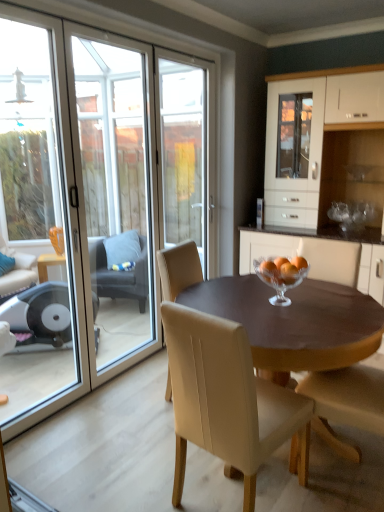
Locate an element on the screen. This screenshot has width=384, height=512. vacant space to the right of clear glass bowl at center is located at coordinates (342, 300).